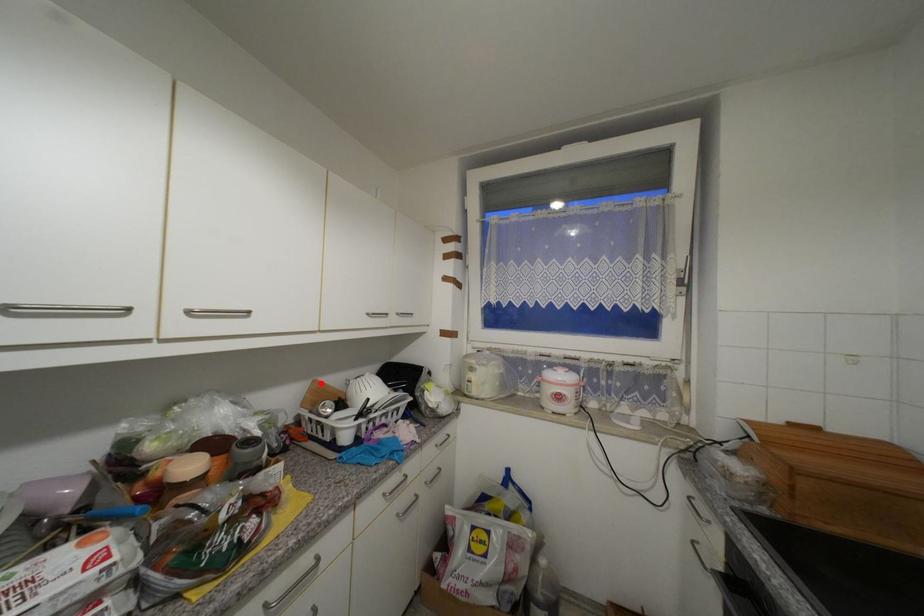
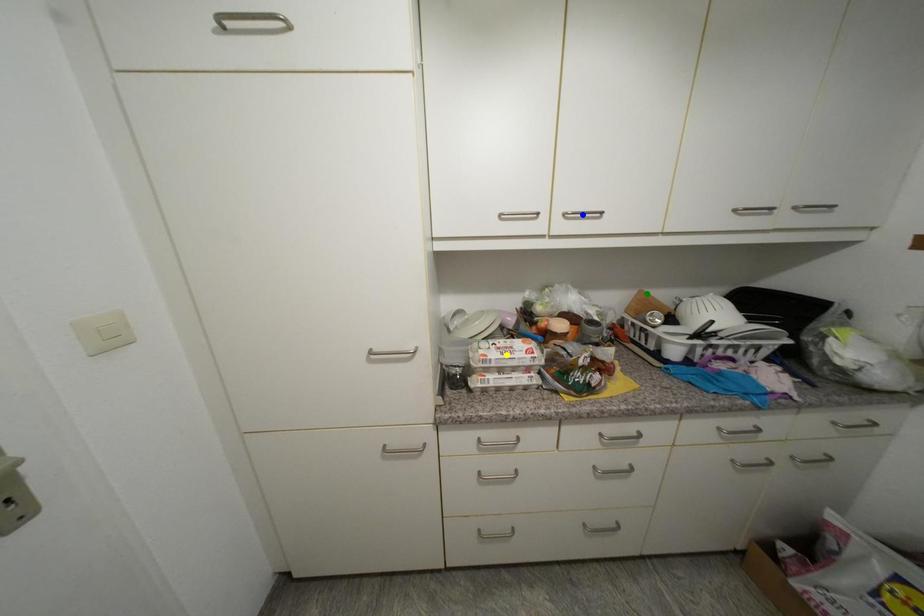
Question: I am providing you with two images of the same scene from different viewpoints. A red point is marked on the first image. You are given multiple points on the second image. Which spot in image 2 lines up with the point in image 1?

Choices:
 (A) yellow point
 (B) green point
 (C) blue point

Answer: (B)